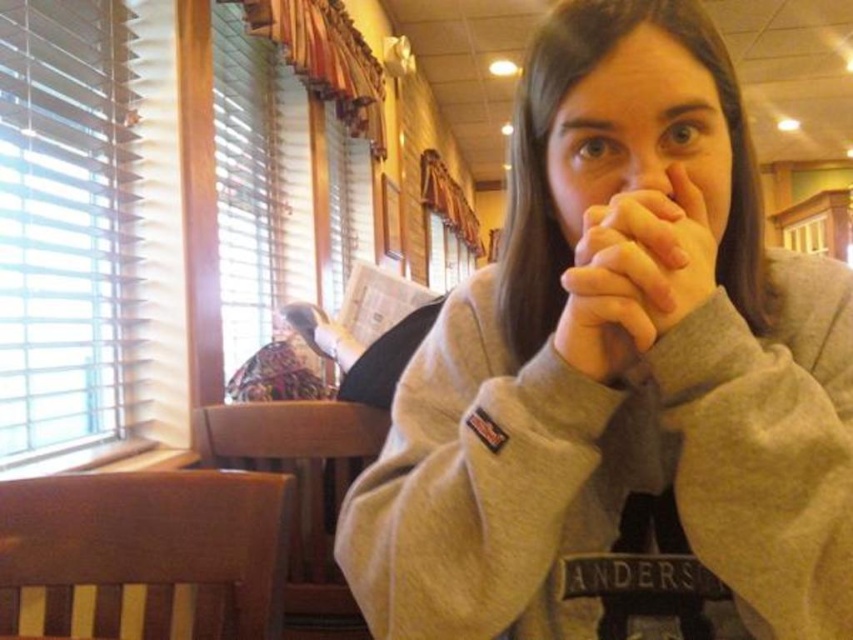
Question: Which of the following is the closest to the observer?

Choices:
 (A) tap(605, 211)
 (B) tap(666, 176)

Answer: (A)

Question: Which object appears farthest from the camera in this image?

Choices:
 (A) matte skin nose at center
 (B) smooth skin hands at center
 (C) gray fleece sweatshirt at center

Answer: (A)

Question: Can you confirm if gray fleece sweatshirt at center is positioned below smooth skin hands at center?

Choices:
 (A) yes
 (B) no

Answer: (A)

Question: Is gray fleece sweatshirt at center positioned before smooth skin hands at center?

Choices:
 (A) yes
 (B) no

Answer: (A)

Question: Does gray fleece sweatshirt at center appear on the right side of smooth skin hands at center?

Choices:
 (A) yes
 (B) no

Answer: (A)

Question: Which of these objects is positioned closest to the smooth skin hands at center?

Choices:
 (A) matte skin nose at center
 (B) gray fleece sweatshirt at center

Answer: (A)